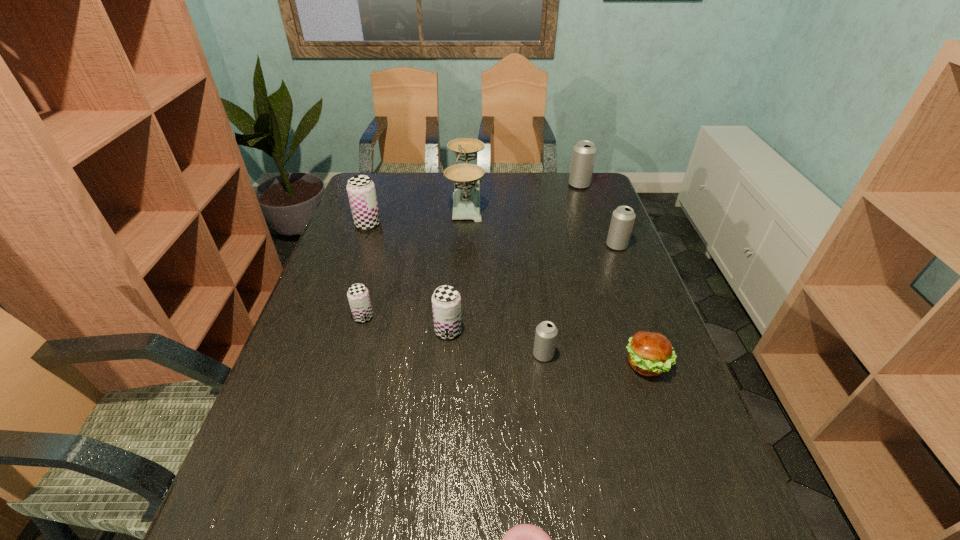
Identify the location of the second purple beer can from left to right. The image size is (960, 540). (358, 296).

You are a GUI agent. You are given a task and a screenshot of the screen. Output one action in this format:
    pyautogui.click(x=<x>, y=<y>)
    Task: Click on the nearest white beer can
    The width and height of the screenshot is (960, 540).
    Given the screenshot: What is the action you would take?
    (546, 332)

Identify the location of the nearest beer can. The width and height of the screenshot is (960, 540). (546, 332).

You are a GUI agent. You are given a task and a screenshot of the screen. Output one action in this format:
    pyautogui.click(x=<x>, y=<y>)
    Task: Click on the hamburger
    
    Given the screenshot: What is the action you would take?
    pyautogui.click(x=650, y=353)

You are a GUI agent. You are given a task and a screenshot of the screen. Output one action in this format:
    pyautogui.click(x=<x>, y=<y>)
    Task: Click on the free spot located on the front-facing side of the tallest object
    
    Given the screenshot: What is the action you would take?
    pyautogui.click(x=526, y=198)

Where is `vacant point located 0.120m on the left of the farthest white beer can`? vacant point located 0.120m on the left of the farthest white beer can is located at coordinates (537, 185).

Where is `vacant space located 0.180m on the right of the leftmost purple beer can`? This screenshot has height=540, width=960. vacant space located 0.180m on the right of the leftmost purple beer can is located at coordinates (434, 224).

Locate an element on the screen. vacant space situated on the right of the fourth beer can from right to left is located at coordinates (588, 331).

Image resolution: width=960 pixels, height=540 pixels. In order to click on vacant area situated 0.340m on the front of the sixth nearest object in this screenshot , I will do `click(651, 334)`.

This screenshot has width=960, height=540. Identify the location of vacant area situated 0.370m on the front of the second object from left to right. (324, 463).